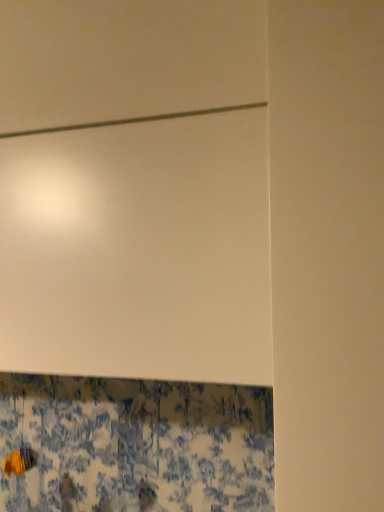
What do you see at coordinates (134, 445) in the screenshot? This screenshot has height=512, width=384. I see `blue floral fabric at lower center` at bounding box center [134, 445].

Measure the distance between point (58, 385) and camera.

Point (58, 385) is 1.15 meters from camera.

Identify the location of blue floral fabric at lower center. This screenshot has height=512, width=384. (134, 445).

You are a GUI agent. You are given a task and a screenshot of the screen. Output one action in this format:
    pyautogui.click(x=<x>, y=<y>)
    Task: Click on the blue floral fabric at lower center
    
    Given the screenshot: What is the action you would take?
    pyautogui.click(x=134, y=445)